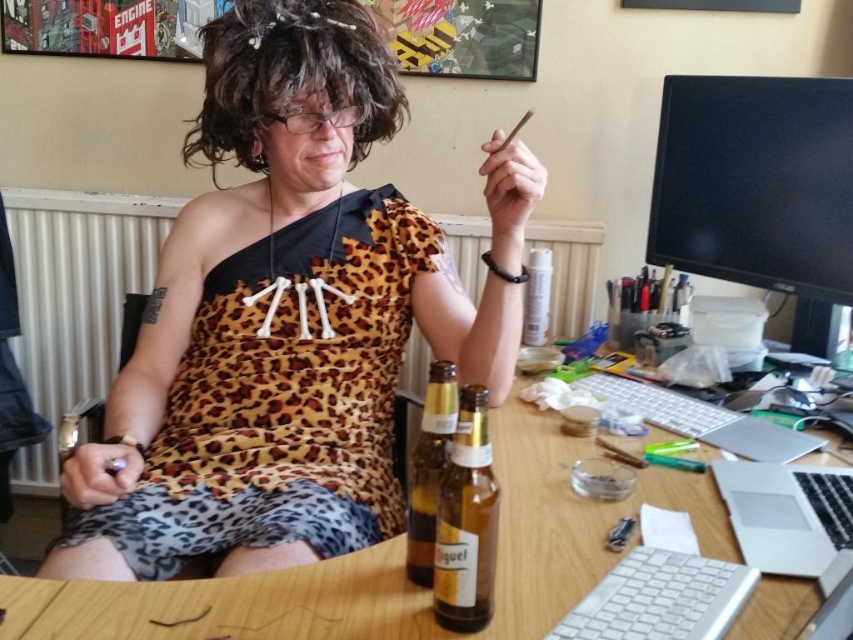
Question: Is curly brown hair at upper center smaller than silver metallic laptop at right?

Choices:
 (A) no
 (B) yes

Answer: (A)

Question: Which of the following is the farthest from the observer?

Choices:
 (A) (723, 509)
 (B) (222, 61)

Answer: (B)

Question: Which object is closer to the camera taking this photo?

Choices:
 (A) silver metallic laptop at right
 (B) curly brown hair at upper center
 (C) leopard print dress at center
 (D) brown glass bottle at center

Answer: (D)

Question: Is wooden table at center below translucent glass bottle at center?

Choices:
 (A) no
 (B) yes

Answer: (A)

Question: Among these points, which one is farthest from the camera?

Choices:
 (A) (454, 586)
 (B) (430, 582)
 (C) (744, 518)
 (D) (254, 557)

Answer: (D)

Question: Does leopard print dress at center have a greater width compared to black glossy monitor at upper right?

Choices:
 (A) yes
 (B) no

Answer: (A)